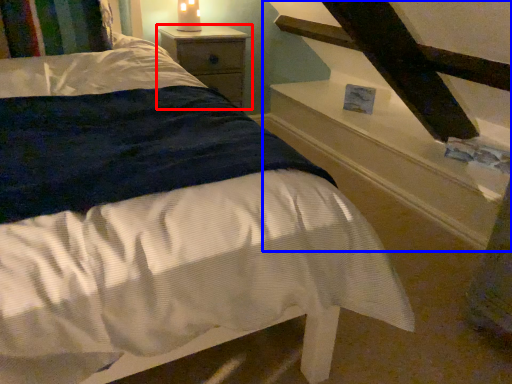
Question: Which object is closer to the camera taking this photo, nightstand (highlighted by a red box) or stairwell (highlighted by a blue box)?

Choices:
 (A) nightstand
 (B) stairwell

Answer: (B)